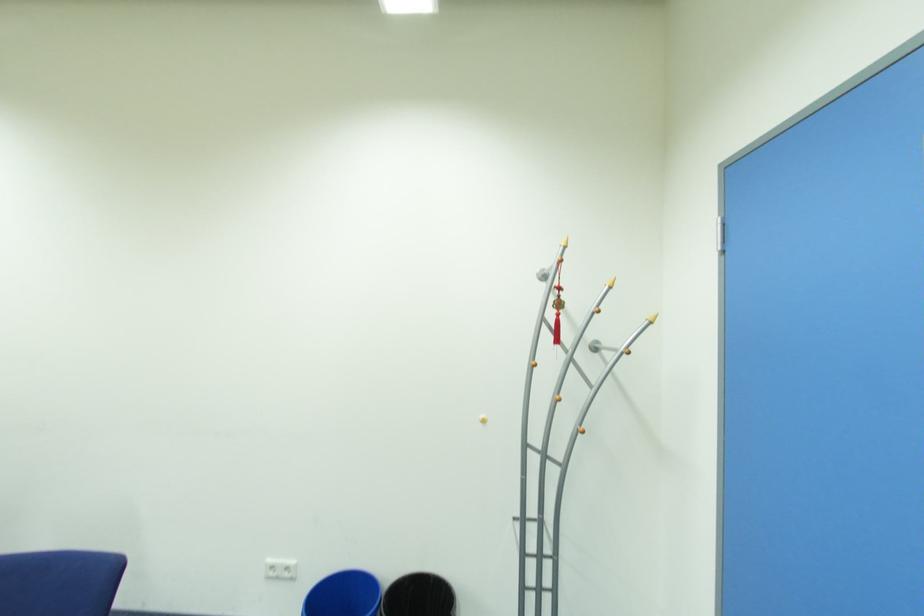
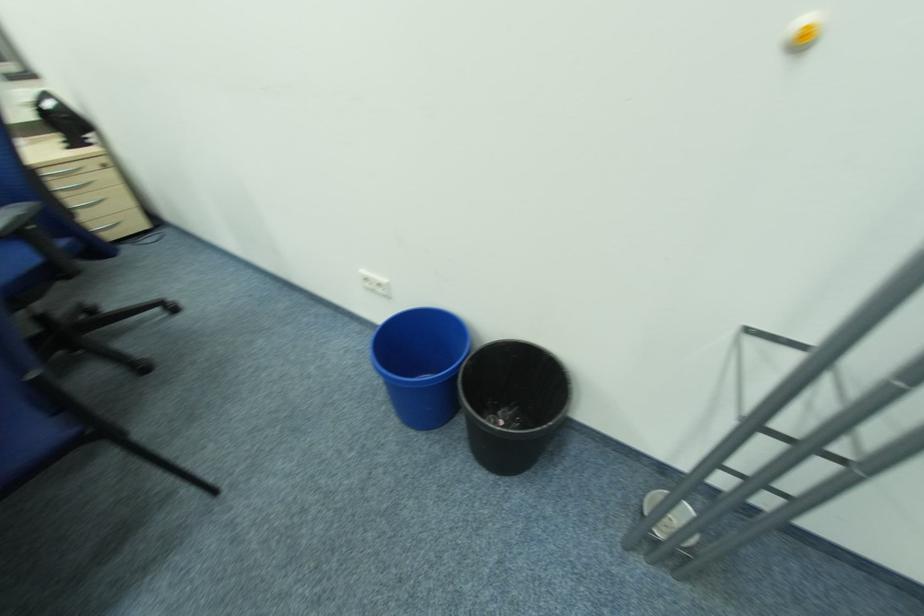
Based on the continuous images, in which direction is the camera rotating?

The camera rotated toward left-down.